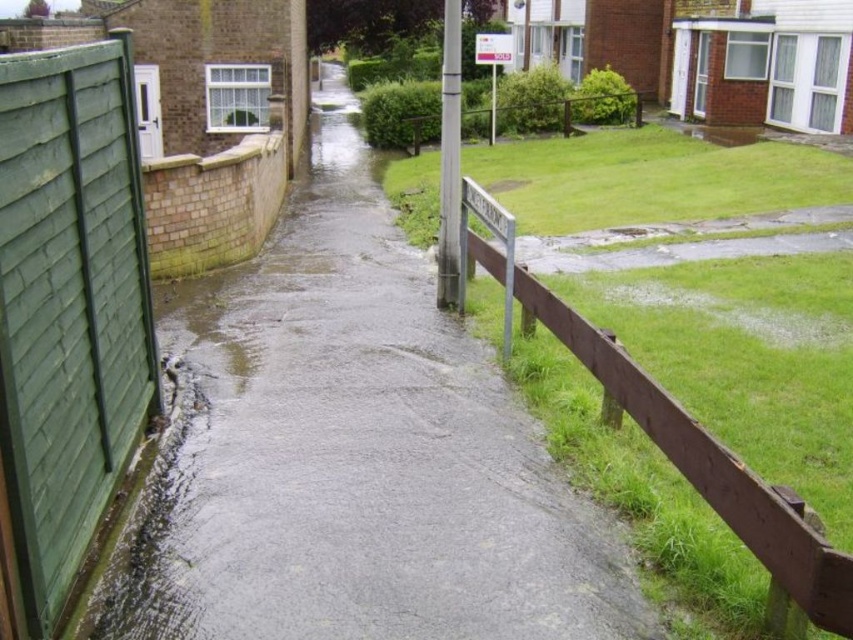
You are a delivery robot with a 1.2 meter wide package. You need to navigate from the flooded area near the green wooden fence at left to the white plastic sign at center. Can you safely pass through the narrowest point between them?

The distance between the green wooden fence at left and the white plastic sign at center is 19.52 meters, which is much wider than the 1.2 meter width of your package. Therefore, you can safely pass through the narrowest point between them.

You are a delivery person trying to navigate through the flooded area. You see the green wooden fence at left and the brown wooden fence at upper center. Which fence is closer to the ground?

The green wooden fence at left is located below brown wooden fence at upper center, so the green wooden fence at left is closer to the ground.